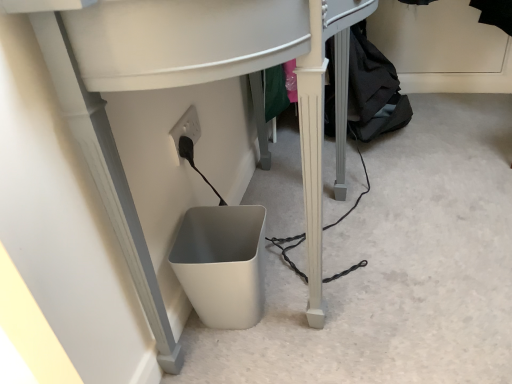
Locate an element on the screen. This screenshot has width=512, height=384. vacant space to the right of black fabric at lower right is located at coordinates (453, 119).